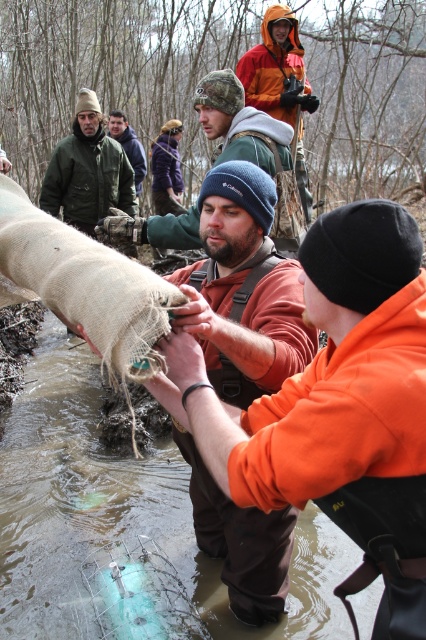
You are an observer standing in the woods looking at the scene. You notice the matte brown bag at center and the green woolen hat at upper center. Which object is narrower?

The matte brown bag at center is narrower than the green woolen hat at upper center.

You are part of a team working near a stream in a wooded area. You see a matte brown bag at center and a green woolen hat at upper center. Which item is located to the right of the other?

The matte brown bag at center is positioned on the right side of green woolen hat at upper center.

You are a photographer trying to capture a clear shot of the orange fleece jacket at center and the green woolen hat at upper center. Which object should you focus on first to ensure both are in focus?

The orange fleece jacket at center is in front of the green woolen hat at upper center, so you should focus on the orange fleece jacket at center first to ensure both are in focus.